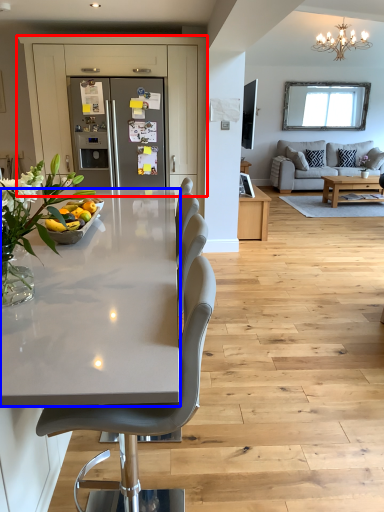
Question: Which object is closer to the camera taking this photo, cabinetry (highlighted by a red box) or countertop (highlighted by a blue box)?

Choices:
 (A) cabinetry
 (B) countertop

Answer: (B)